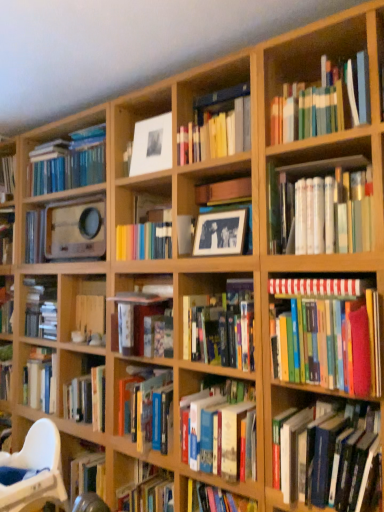
Question: From the image's perspective, is white matte picture frame at upper center under white glossy book at upper right, the seventh book ordered from the bottom?

Choices:
 (A) yes
 (B) no

Answer: (B)

Question: From a real-world perspective, is white matte picture frame at upper center beneath white glossy book at upper right, which is the 2th book from top to bottom?

Choices:
 (A) no
 (B) yes

Answer: (A)

Question: Is white matte picture frame at upper center positioned with its back to white glossy book at upper right, the seventh book ordered from the bottom?

Choices:
 (A) no
 (B) yes

Answer: (A)

Question: Does white matte picture frame at upper center have a lesser width compared to white glossy book at upper right, which is the 2th book from top to bottom?

Choices:
 (A) no
 (B) yes

Answer: (B)

Question: Considering the relative positions of white matte picture frame at upper center and white glossy book at upper right, which is the 2th book from top to bottom, in the image provided, is white matte picture frame at upper center in front of white glossy book at upper right, which is the 2th book from top to bottom,?

Choices:
 (A) no
 (B) yes

Answer: (A)

Question: From a real-world perspective, relative to hardcover books at lower right, which is the second book in bottom-to-top order, is white glossy book at upper right, the seventh book ordered from the bottom, vertically above or below?

Choices:
 (A) below
 (B) above

Answer: (B)

Question: From the image's perspective, is white glossy book at upper right, the seventh book ordered from the bottom, positioned above or below hardcover books at lower right, which is the second book in bottom-to-top order?

Choices:
 (A) below
 (B) above

Answer: (B)

Question: Is white glossy book at upper right, the seventh book ordered from the bottom, wider or thinner than hardcover books at lower right, the seventh book positioned from the top?

Choices:
 (A) wide
 (B) thin

Answer: (A)

Question: Considering the positions of point (349, 168) and point (339, 433), is point (349, 168) closer or farther from the camera than point (339, 433)?

Choices:
 (A) closer
 (B) farther

Answer: (B)

Question: Considering the positions of point (370, 490) and point (342, 168), is point (370, 490) closer or farther from the camera than point (342, 168)?

Choices:
 (A) farther
 (B) closer

Answer: (B)

Question: In terms of width, does hardcover books at lower right, the seventh book positioned from the top, look wider or thinner when compared to white glossy book at upper right, which is the 2th book from top to bottom?

Choices:
 (A) thin
 (B) wide

Answer: (A)

Question: In terms of size, does hardcover books at lower right, the seventh book positioned from the top, appear bigger or smaller than white glossy book at upper right, which is the 2th book from top to bottom?

Choices:
 (A) big
 (B) small

Answer: (A)

Question: From a real-world perspective, relative to white glossy book at upper right, which is the 2th book from top to bottom, is hardcover books at lower right, which is the second book in bottom-to-top order, vertically above or below?

Choices:
 (A) below
 (B) above

Answer: (A)

Question: In terms of width, does white matte picture frame at upper center look wider or thinner when compared to hardcover books at center, acting as the 8th book starting from the top?

Choices:
 (A) wide
 (B) thin

Answer: (B)

Question: Is white matte picture frame at upper center taller or shorter than hardcover books at center, acting as the 8th book starting from the top?

Choices:
 (A) short
 (B) tall

Answer: (A)